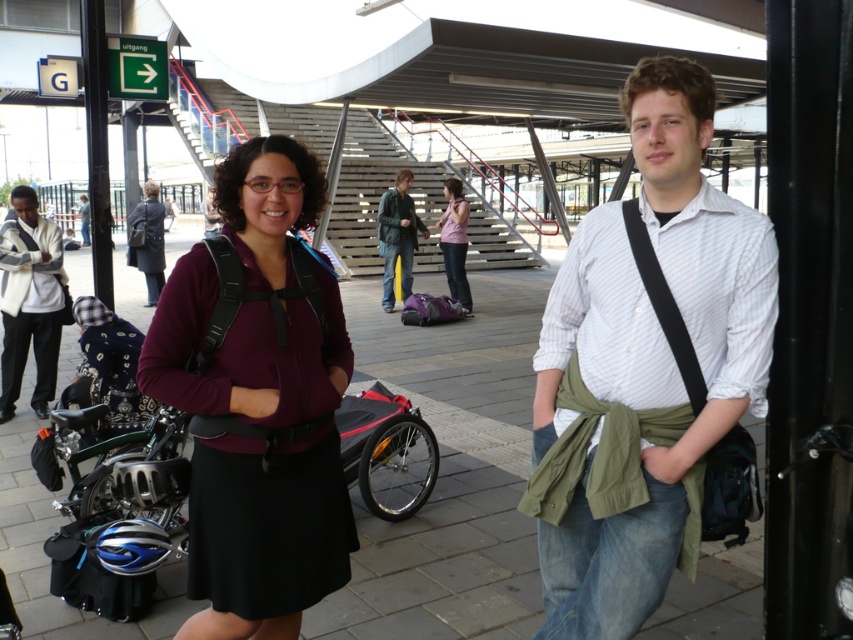
You are a security guard at the transportation hub and need to check the contents of the matte black backpack at center. According to the security protocol, you must approach the backpack from the nearest unobstructed path. Based on the coordinates provided in the description, can you determine the direction you should approach from to ensure you reach the backpack safely?

The matte black backpack at center is located at point (258, 397). Since the coordinates are given in a normalized format, the x and y values indicate the position relative to the image frame. To approach from the nearest unobstructed path, you should move towards the backpack from the direction of lower coordinates, ensuring you navigate around any obstacles in the scene such as people or railings. However, without additional spatial details about obstructions, the safest path would be directly towards 0

You are a delivery person carrying a box that is 1.5 meters tall. You need to place it on the smooth concrete pavement at center. Will the box be taller than the green matte jacket at center?

The smooth concrete pavement at center has a lesser height compared to green matte jacket at center. Since the box is 1.5 meters tall, it will be taller than the green matte jacket at center.